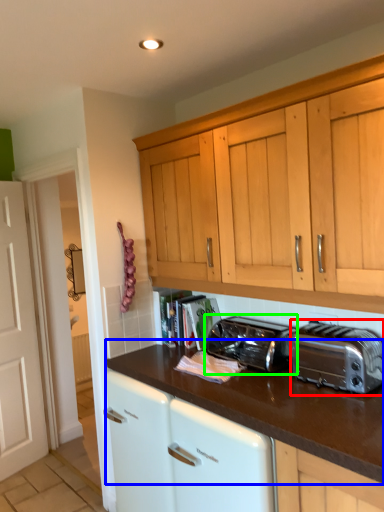
Question: Considering the real-world distances, which object is closest to toaster (highlighted by a red box)? countertop (highlighted by a blue box) or toaster (highlighted by a green box).

Choices:
 (A) countertop
 (B) toaster

Answer: (A)